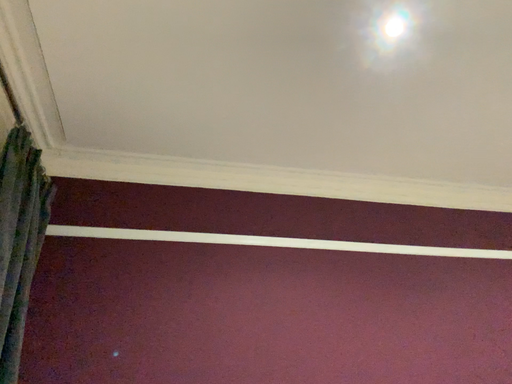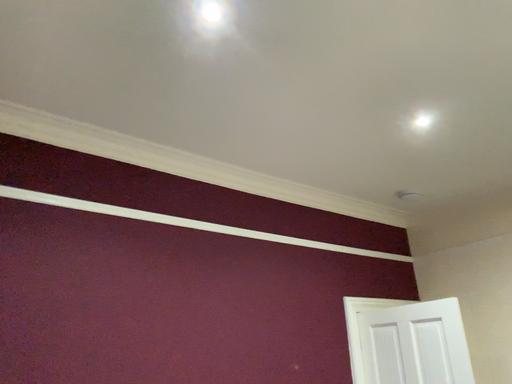
Question: Which way did the camera rotate in the video?

Choices:
 (A) rotated downward
 (B) rotated upward

Answer: (A)